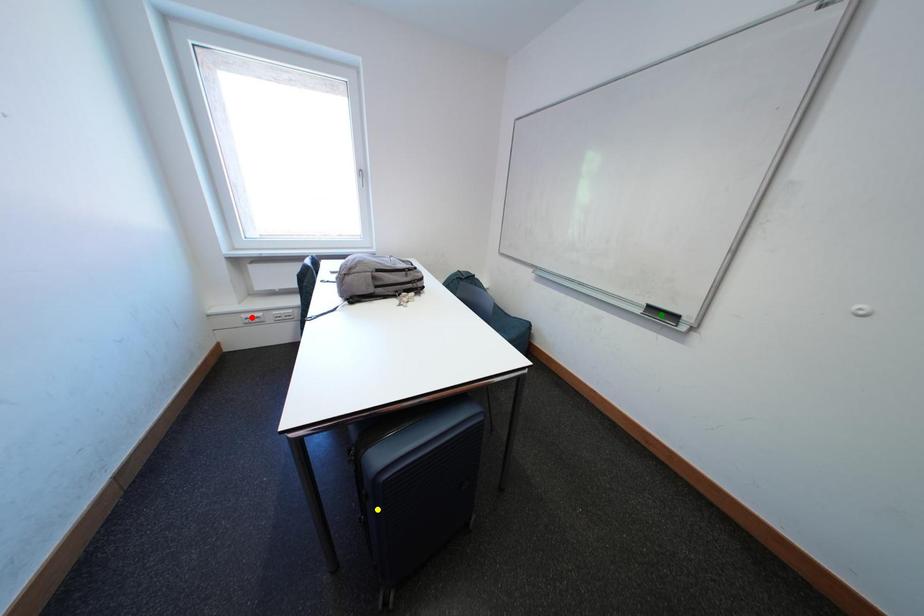
Order these from nearest to farthest:
1. red point
2. yellow point
3. green point

yellow point
green point
red point